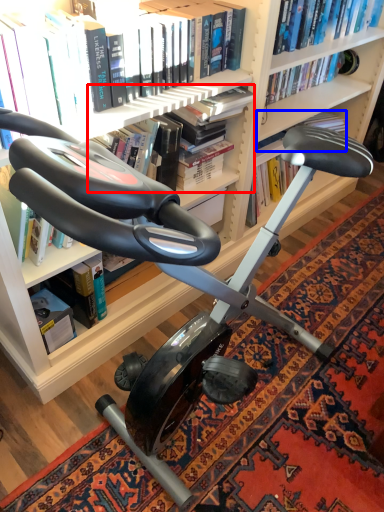
Question: Which of the following is the farthest to the observer, book (highlighted by a red box) or book (highlighted by a blue box)?

Choices:
 (A) book
 (B) book

Answer: (B)